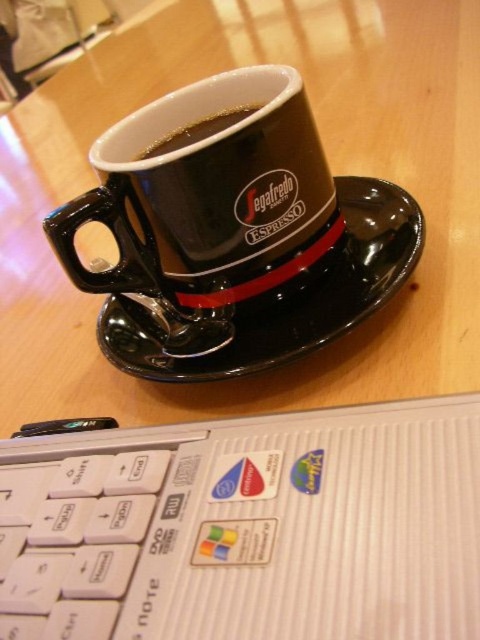
You are looking at the scene and want to place a small sticker exactly halfway between point (245, 412) and point (164, 356). Which point will be closer to the espresso cup and saucer?

The point halfway between point (245, 412) and point (164, 356) will be closer to the espresso cup and saucer because point (245, 412) is in front of point (164, 356).

You are trying to reach for the glossy ceramic mug at center and the black glossy cup at upper center. Which one can you grab first without moving your hand?

The glossy ceramic mug at center is closer to the viewer than the black glossy cup at upper center, so you can grab it first without moving your hand.

You are trying to place a small book between the wooden table at center and the black glossy cup at upper center. Can you do this?

The wooden table at center is closer to the viewer than the black glossy cup at upper center, so you cannot place the book between them because the cup is further away and not on the table surface.